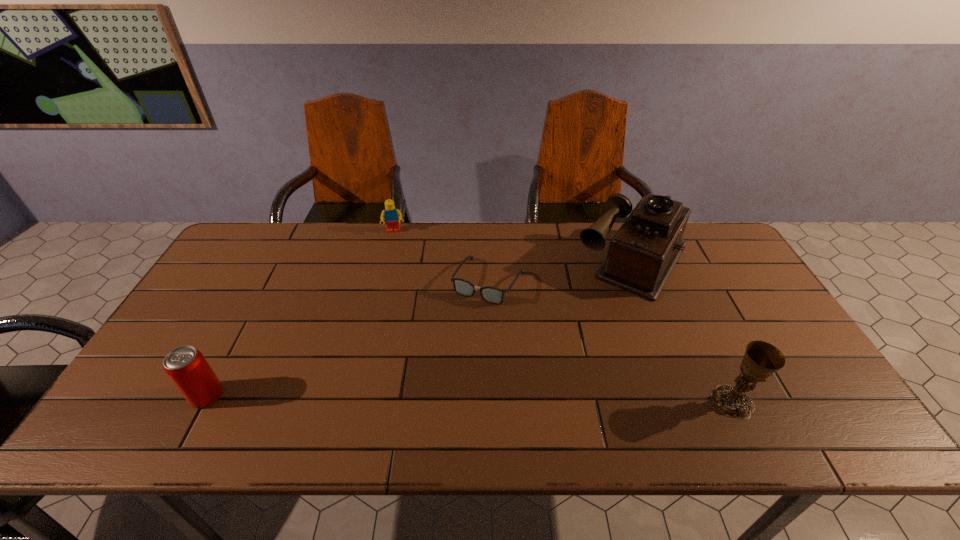
At what (x,y) coordinates should I click in order to perform the action: click on free space located 0.120m on the face of the spectacles. Please return your answer as a coordinate pair (x, y). This screenshot has height=540, width=960. Looking at the image, I should click on (457, 335).

Identify the location of free space located on the face of the spectacles. This screenshot has width=960, height=540. (459, 332).

Where is `vacant space located on the face of the spectacles`? This screenshot has width=960, height=540. vacant space located on the face of the spectacles is located at coordinates (419, 401).

At what (x,y) coordinates should I click in order to perform the action: click on free space located on the horn of the phonograph_record. Please return your answer as a coordinate pair (x, y). This screenshot has height=540, width=960. Looking at the image, I should click on (587, 329).

I want to click on vacant space located 0.370m on the horn of the phonograph_record, so click(x=553, y=381).

What are the coordinates of `free space located 0.150m on the horn of the phonograph_record` in the screenshot? It's located at (589, 325).

Identify the location of free space located on the front-facing side of the second object from left to right. This screenshot has width=960, height=540. pyautogui.click(x=395, y=246).

I want to click on free space located 0.070m on the front-facing side of the second object from left to right, so click(x=395, y=247).

The image size is (960, 540). What are the coordinates of `free space located on the front-facing side of the second object from left to right` in the screenshot? It's located at (396, 280).

The height and width of the screenshot is (540, 960). Find the location of `spectacles present at the far edge`. spectacles present at the far edge is located at coordinates (493, 295).